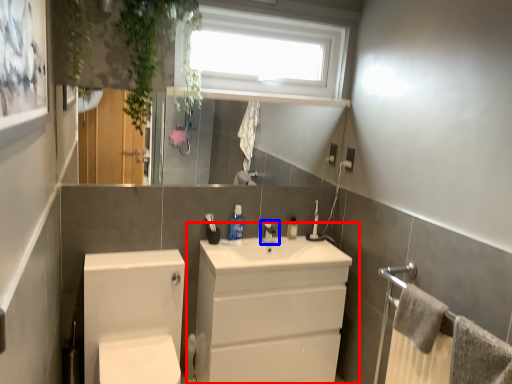
Question: Which object is further to the camera taking this photo, bathroom cabinet (highlighted by a red box) or tap (highlighted by a blue box)?

Choices:
 (A) bathroom cabinet
 (B) tap

Answer: (B)